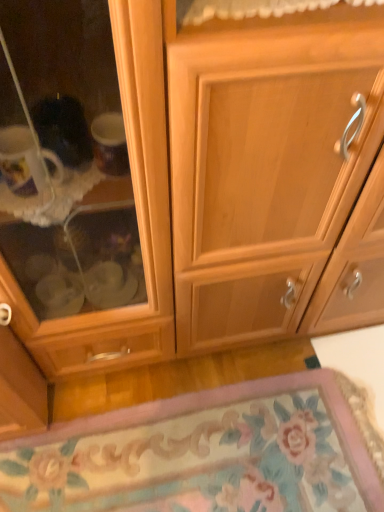
What are the coordinates of `floral carpet at lower center` in the screenshot? It's located at (204, 454).

What do you see at coordinates (204, 454) in the screenshot?
I see `floral carpet at lower center` at bounding box center [204, 454].

The width and height of the screenshot is (384, 512). Find the location of `floral carpet at lower center`. floral carpet at lower center is located at coordinates (204, 454).